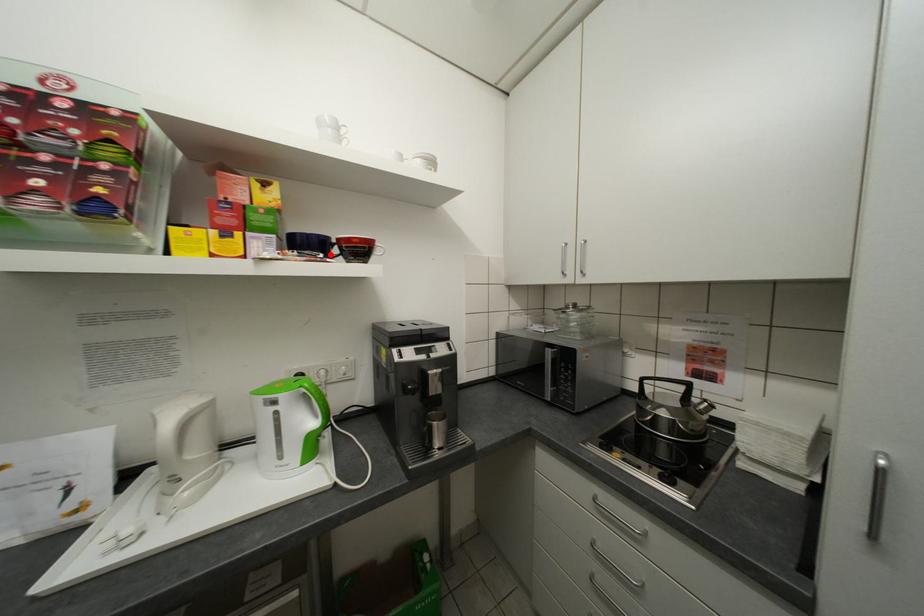
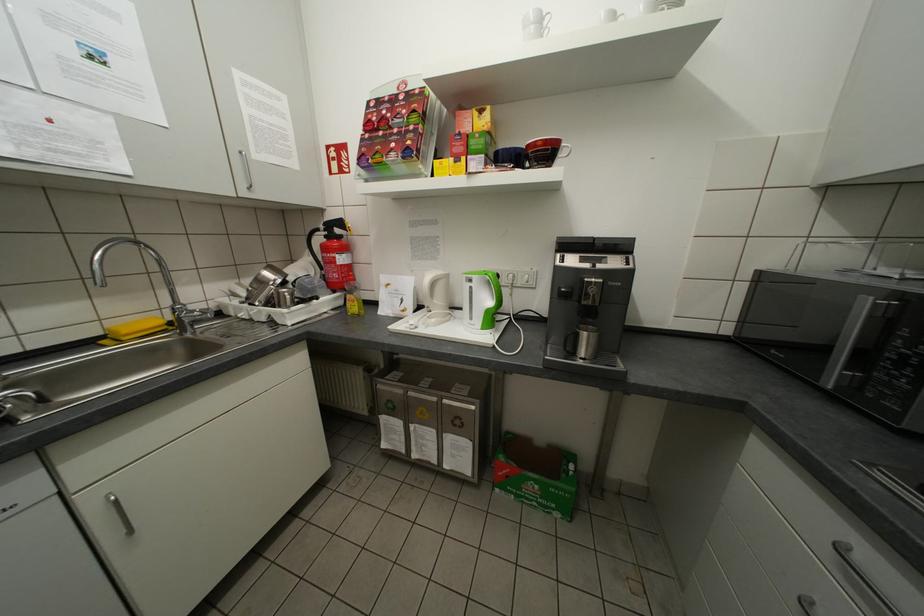
Locate, in the second image, the point that corresponds to the highlighted location in the first image.

(521, 166)